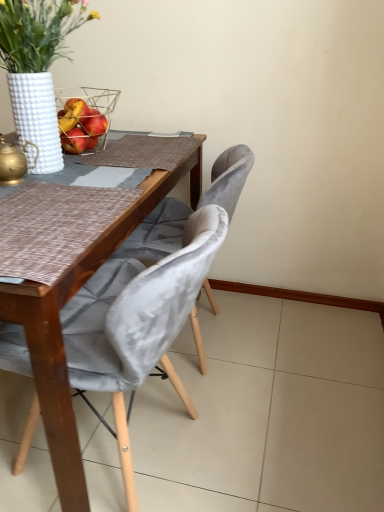
Find the location of `vacant area in front of gold metallic teapot at left`. vacant area in front of gold metallic teapot at left is located at coordinates (20, 202).